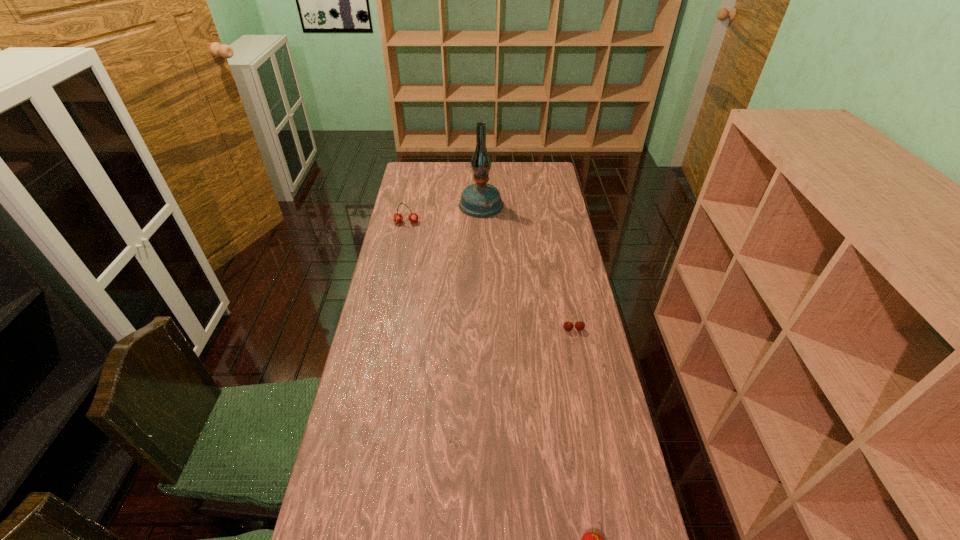
The image size is (960, 540). I want to click on the third object from right to left, so click(x=479, y=200).

The width and height of the screenshot is (960, 540). I want to click on oil lamp, so click(x=479, y=200).

I want to click on the leftmost cherry, so click(x=413, y=217).

In order to click on the third nearest object in this screenshot , I will do `click(413, 217)`.

Find the location of `the shortest cherry`. the shortest cherry is located at coordinates coord(568,326).

Where is `the second nearest object`? the second nearest object is located at coordinates (568, 326).

The width and height of the screenshot is (960, 540). What are the coordinates of `vacant region located on the front of the tallest object` in the screenshot? It's located at (481, 237).

This screenshot has height=540, width=960. Identify the location of free location located with stems pointing upwards on the farthest cherry. (396, 275).

In order to click on vacant area located on the surface of the second nearest cherry in this screenshot , I will do `click(579, 359)`.

The height and width of the screenshot is (540, 960). Identify the location of object located in the left edge section of the desktop. (413, 217).